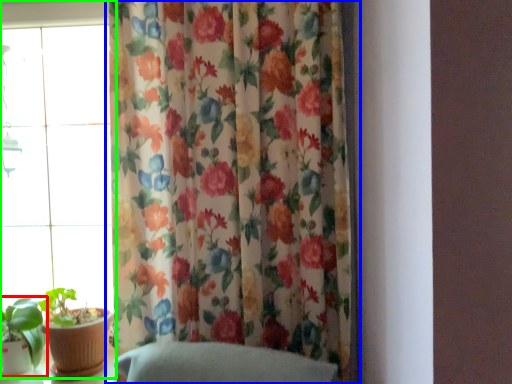
Question: Considering the real-world distances, which object is farthest from houseplant (highlighted by a red box)? curtain (highlighted by a blue box) or window (highlighted by a green box)?

Choices:
 (A) curtain
 (B) window

Answer: (A)